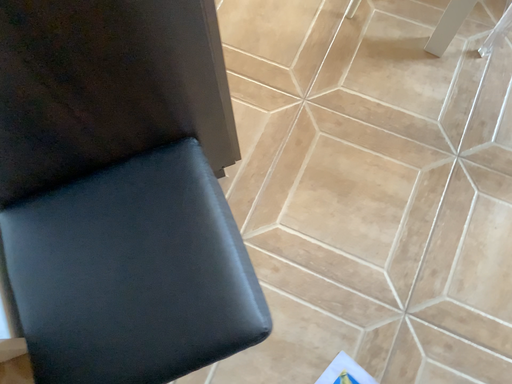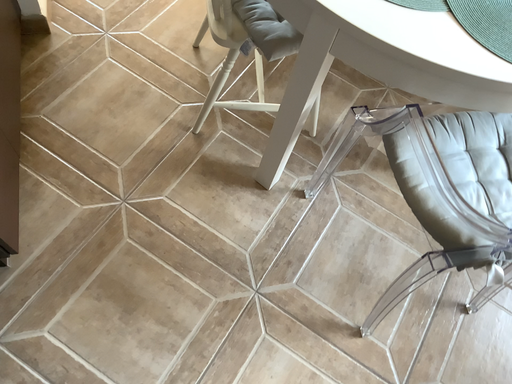
Question: Which way did the camera rotate in the video?

Choices:
 (A) rotated upward
 (B) rotated downward

Answer: (A)